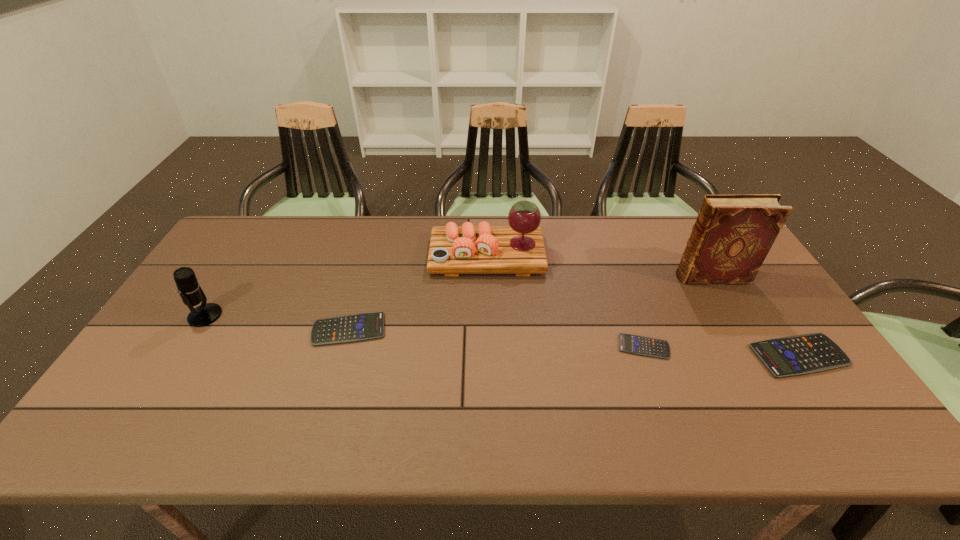
The height and width of the screenshot is (540, 960). Identify the location of vacant spot for a new calculator to ensure equal spacing. (493, 338).